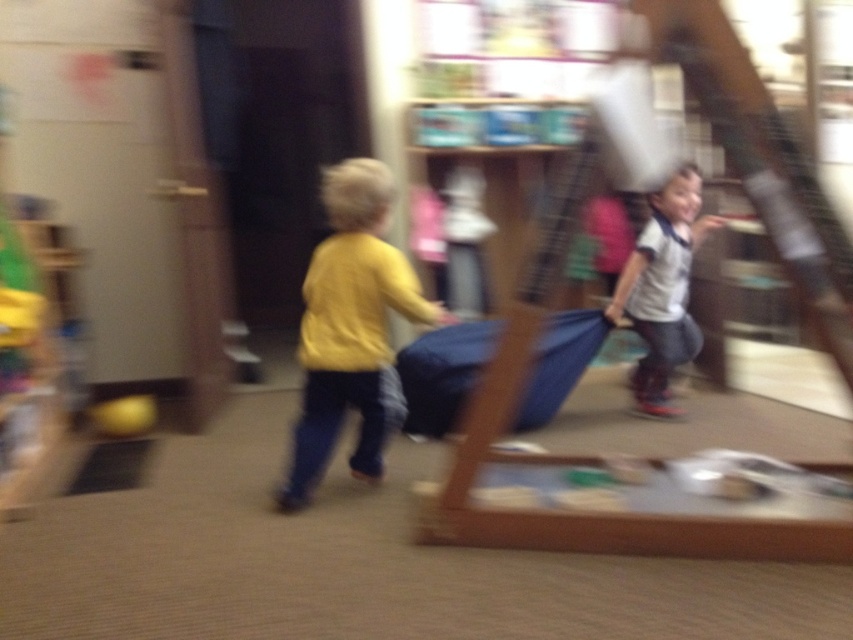
Measure the distance between yellow matte shirt at left and camera.

yellow matte shirt at left and camera are 2.48 meters apart from each other.

Which of these two, yellow matte shirt at left or white matte shirt at right, stands taller?

yellow matte shirt at left is taller.

Is point (335, 292) farther from camera compared to point (651, 291)?

No, it is in front of (651, 291).

This screenshot has width=853, height=640. What are the coordinates of `yellow matte shirt at left` in the screenshot? It's located at (351, 328).